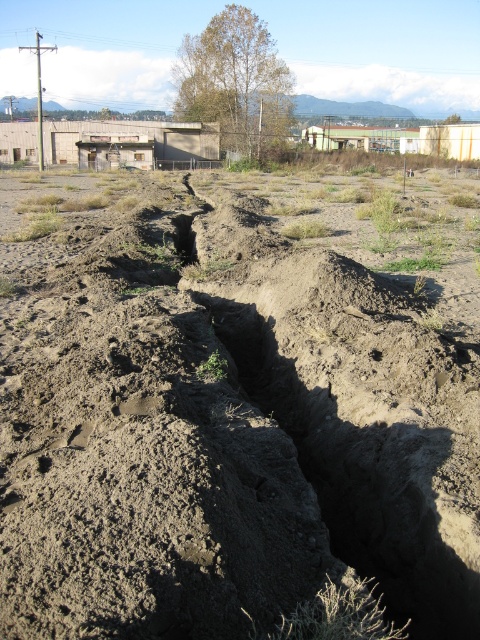
You are a construction worker tasked with leveling the ground in the trench. You notice two types of dirt in the trench, the dull brown dirt at center and the dark brown dirt at center. Which type of dirt is higher in elevation compared to the other?

The dull brown dirt at center is much taller than the dark brown dirt at center, so the dull brown dirt at center is higher in elevation compared to the dark brown dirt at center.